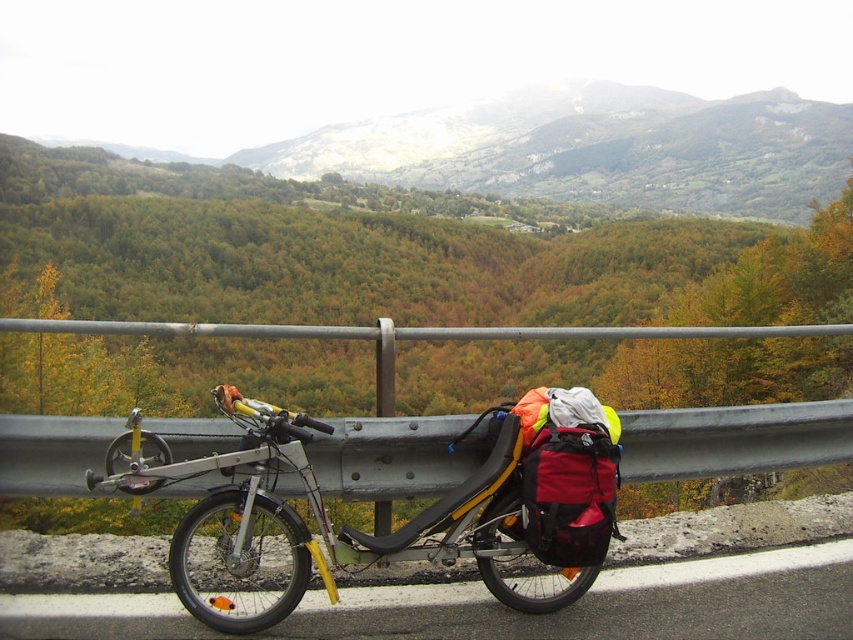
You are planning to take a short trip and need to choose between the silver metallic bicycle at center and the black rubber bicycle at lower center. Which one is bigger in size?

→ The silver metallic bicycle at center has a larger size compared to the black rubber bicycle at lower center, so the silver metallic bicycle at center is bigger in size.

You are standing at the roadside and want to secure your bicycle against the metallic gray guardrail at center. Given the guardrail is positioned at coordinates approximately 0.688 on the x and 0.862 on the y axis, can you estimate whether the guardrail is located closer to the center of the image or near the edges?

The metallic gray guardrail at center is located at coordinates approximately 0.688 on the x and 0.862 on the y axis, which places it closer to the center of the image rather than near the edges.